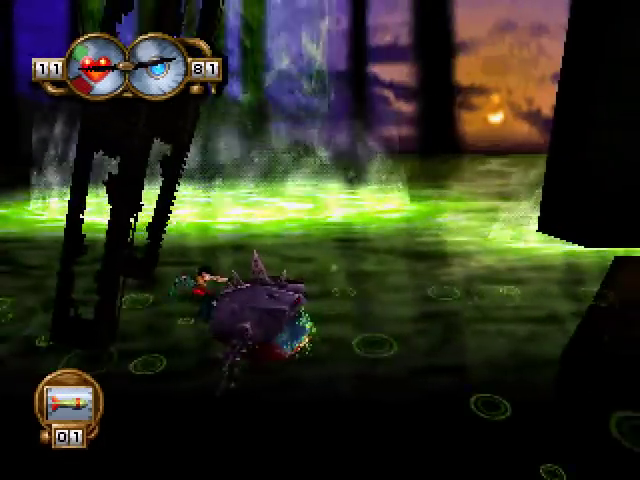
The image size is (640, 480). Identify the location of bright yellow light. (493, 120).